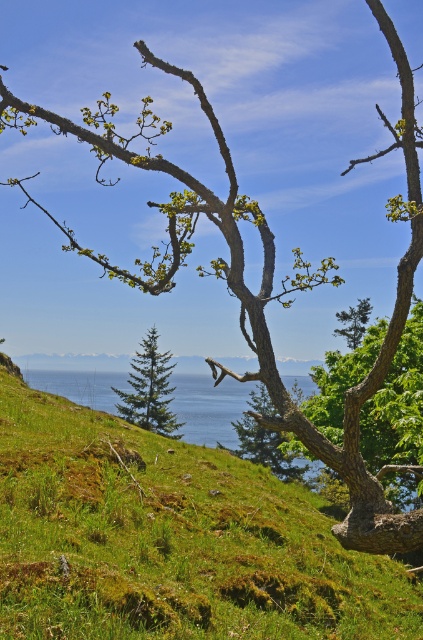
You are standing in front of the tree in the image and want to take a photo. There are two points marked in the scene, point 1 at coordinates point (401, 497) and point 2 at coordinates point (359, 300). Which point is closer to you?

Point 1 at coordinates point (401, 497) is closer to you than point 2 at coordinates point (359, 300).

Looking at this image, you are standing in the landscape and want to take a photo of the green matte evergreen tree at center and the green matte tree at center. Which tree should you focus on first if you want to capture both in a single frame without moving the camera?

The green matte evergreen tree at center is located below the green matte tree at center, so you should focus on the green matte tree at center first as it is higher up to ensure both are in the frame.

You are standing in the middle of a forest path and see both the green leafy tree at center and the green matte tree at center. Which tree is closer to you?

Both the green leafy tree at center and the green matte tree at center are at the same distance of 12.48 feet from you.